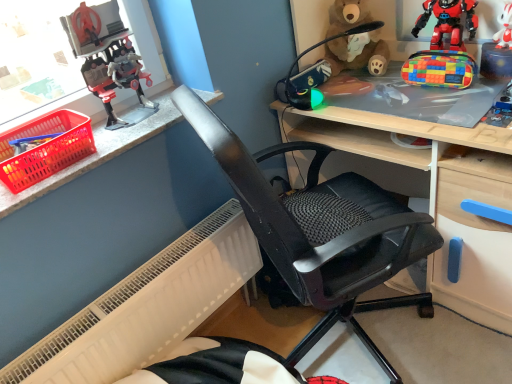
What are the coordinates of `free space to the back side of plastic robot at upper left, which is the fifth toy in right-to-left order` in the screenshot? It's located at (146, 104).